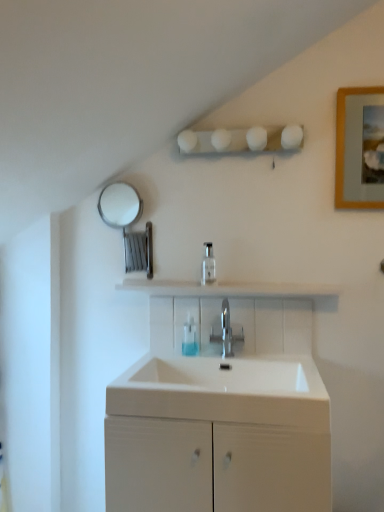
Locate an element on the screen. vacant area on top of white matte light fixture at upper center (from a real-world perspective) is located at coordinates (243, 123).